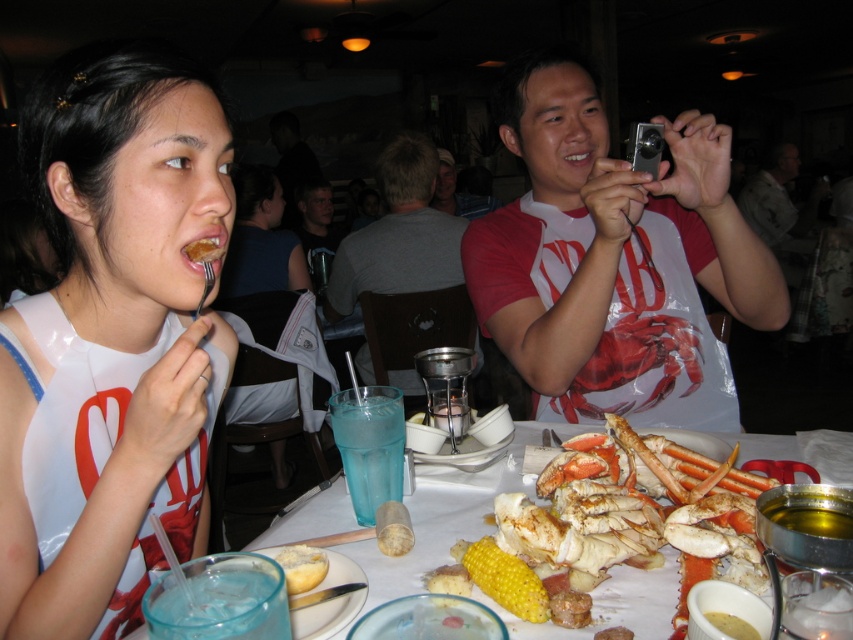
You are a waiter at the seafood restaurant and need to deliver a napkin to both the golden corn cob at center and the golden bread at center. Which one should you place the napkin closer to first based on their positions?

The golden corn cob at center is closer to the viewer than the golden bread at center, so you should place the napkin closer to the golden corn cob at center first.

You are a photographer trying to capture a closeup of the gray fabric shirt at center. Based on the scene description, can you determine if the shirt is visible enough for a clear photo?

The gray fabric shirt at center is located at point (x=398, y=234), which is within the visible area of the image. Therefore, it should be possible to take a clear closeup photo of the gray fabric shirt at center.